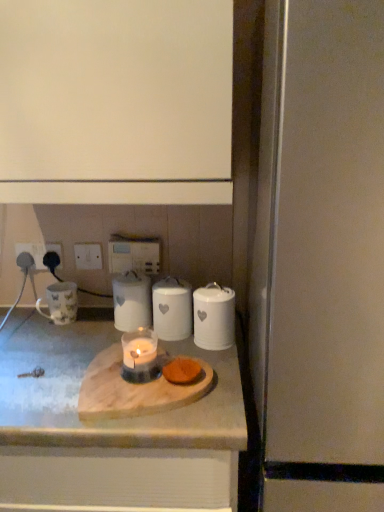
Image resolution: width=384 pixels, height=512 pixels. In order to click on vacant space situated on the left part of white ceramic jar at center, the 3th appliance in the right-to-left sequence in this screenshot , I will do `click(91, 336)`.